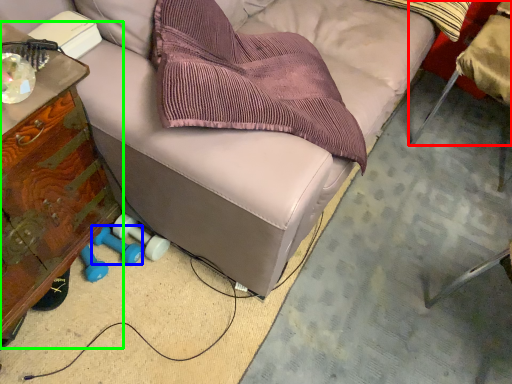
Question: Which object is positioned closest to chair (highlighted by a red box)? Select from dumbbell (highlighted by a blue box) and furniture (highlighted by a green box).

Choices:
 (A) dumbbell
 (B) furniture

Answer: (A)